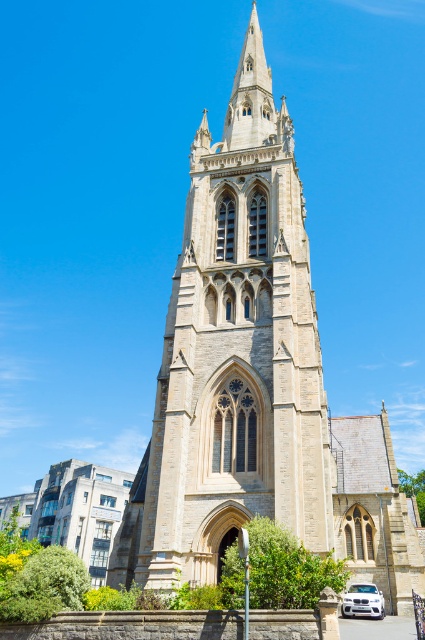
Can you confirm if beige stone tower at center is bigger than white glossy car at lower right?

Correct, beige stone tower at center is larger in size than white glossy car at lower right.

Measure the distance between beige stone tower at center and camera.

A distance of 123.93 feet exists between beige stone tower at center and camera.

Is point (243, 381) in front of point (363, 604)?

No.

The height and width of the screenshot is (640, 425). In order to click on beige stone tower at center in this screenshot , I will do `click(238, 352)`.